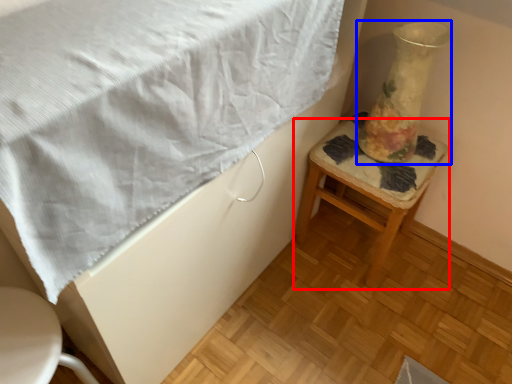
Question: Which object is further to the camera taking this photo, stool (highlighted by a red box) or vase (highlighted by a blue box)?

Choices:
 (A) stool
 (B) vase

Answer: (A)